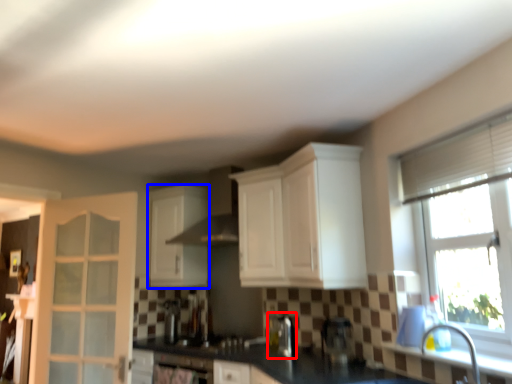
Question: Which point is further to the camera, coffee machine (highlighted by a red box) or cabinetry (highlighted by a blue box)?

Choices:
 (A) coffee machine
 (B) cabinetry

Answer: (B)